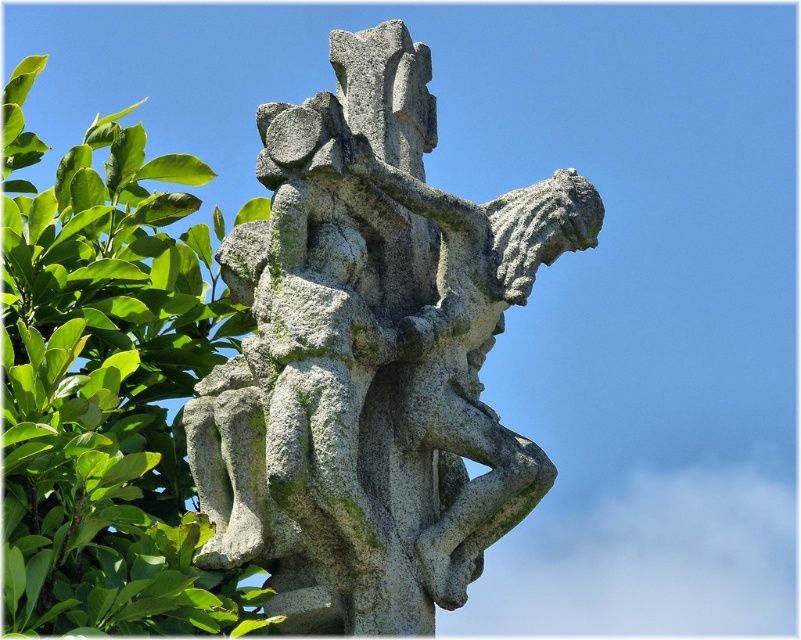
Where is `gray stone sculpture at center`? This screenshot has height=640, width=801. gray stone sculpture at center is located at coordinates (369, 356).

Between point (214, 381) and point (238, 602), which one is positioned behind?

Point (214, 381)

Who is more distant from viewer, (372,476) or (133,284)?

The point (133,284) is more distant.

Image resolution: width=801 pixels, height=640 pixels. I want to click on gray stone sculpture at center, so click(x=369, y=356).